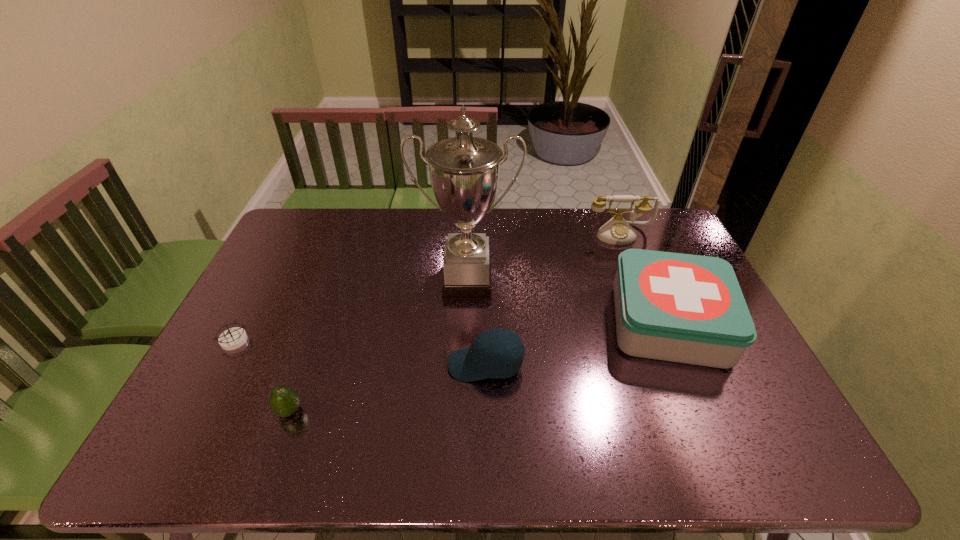
Where is `free space between the avocado and the fourth tallest object`? The width and height of the screenshot is (960, 540). free space between the avocado and the fourth tallest object is located at coordinates (388, 388).

You are a GUI agent. You are given a task and a screenshot of the screen. Output one action in this format:
    pyautogui.click(x=<x>, y=<y>)
    Task: Click on the vacant space that's between the telephone and the third shortest object
    The height and width of the screenshot is (540, 960).
    Given the screenshot: What is the action you would take?
    pyautogui.click(x=553, y=299)

I want to click on free space between the first-aid kit and the shortest object, so click(x=451, y=332).

In order to click on empty location between the telephone and the baseball cap in this screenshot , I will do `click(553, 299)`.

Where is `empty space that is in between the first-aid kit and the shortest object`? The width and height of the screenshot is (960, 540). empty space that is in between the first-aid kit and the shortest object is located at coordinates (451, 332).

Select which object is the fourth closest to the trophy cup. Please provide its 2D coordinates. Your answer should be formatted as a tuple, i.e. [(x, y)], where the tuple contains the x and y coordinates of a point satisfying the conditions above.

[(284, 401)]

This screenshot has height=540, width=960. Find the location of `object that ranks as the second closest to the leftmost object`. object that ranks as the second closest to the leftmost object is located at coordinates (464, 171).

Where is `free space that satisfies the following two spatial constraints: 1. on the front-facing side of the baseball cap; 2. on the front side of the fifth tallest object`? The height and width of the screenshot is (540, 960). free space that satisfies the following two spatial constraints: 1. on the front-facing side of the baseball cap; 2. on the front side of the fifth tallest object is located at coordinates (486, 411).

Where is `free location that satisfies the following two spatial constraints: 1. on the front side of the first-aid kit; 2. on the front-facing side of the fourth tallest object`? free location that satisfies the following two spatial constraints: 1. on the front side of the first-aid kit; 2. on the front-facing side of the fourth tallest object is located at coordinates (686, 364).

You are a GUI agent. You are given a task and a screenshot of the screen. Output one action in this format:
    pyautogui.click(x=<x>, y=<y>)
    Task: Click on the vacant space that satisfies the following two spatial constraints: 1. on the dial of the farthest object; 2. on the right side of the first-aid kit
    
    Given the screenshot: What is the action you would take?
    pyautogui.click(x=654, y=322)